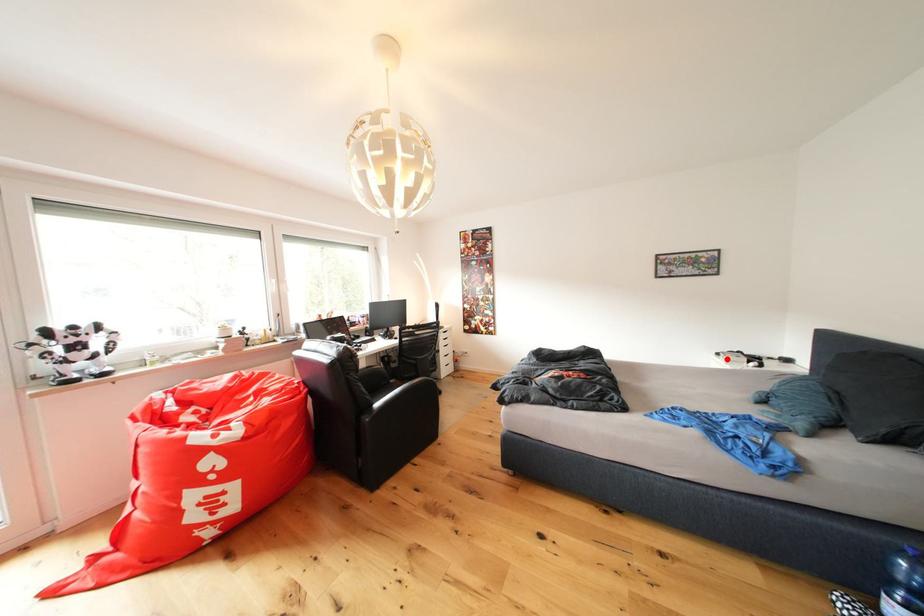
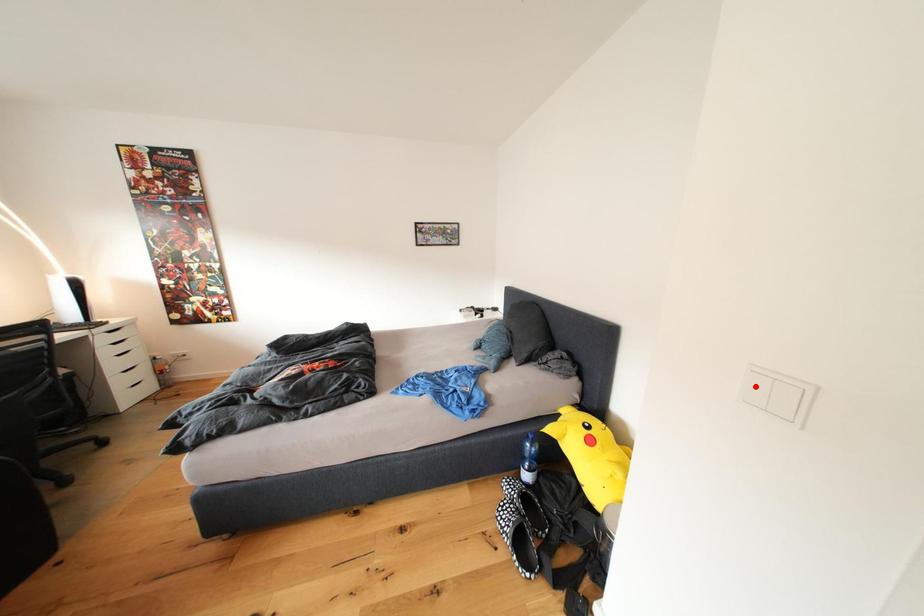
I am providing you with two images of the same scene from different viewpoints. A red point is marked on the first image and another point is marked on the second image. Do the highlighted points in image1 and image2 indicate the same real-world spot?

No